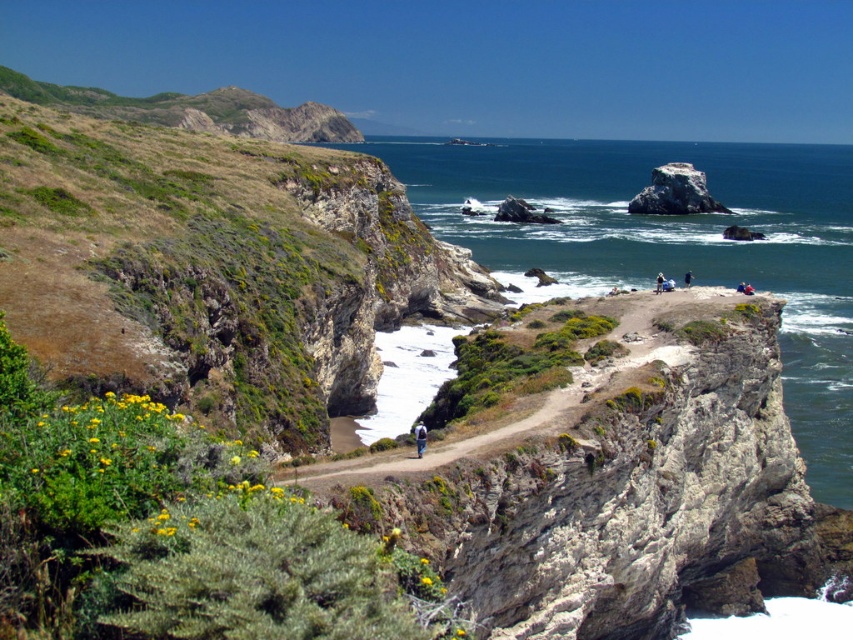
Question: Is green grassy cliff at center-left further to the viewer compared to dark blue fabric at upper center?

Choices:
 (A) no
 (B) yes

Answer: (A)

Question: Which of the following is the farthest from the observer?

Choices:
 (A) (477, 164)
 (B) (315, 195)
 (C) (685, 276)

Answer: (A)

Question: Does clear blue water at upper center have a greater width compared to brown fabric backpack at center?

Choices:
 (A) no
 (B) yes

Answer: (B)

Question: Considering the relative positions of green grassy cliff at center-left and brown fabric backpack at center in the image provided, where is green grassy cliff at center-left located with respect to brown fabric backpack at center?

Choices:
 (A) left
 (B) right

Answer: (A)

Question: Which object appears closest to the camera in this image?

Choices:
 (A) clear blue water at upper center
 (B) dark blue fabric at upper center
 (C) brown fabric backpack at center
 (D) white fabric at center

Answer: (C)

Question: Among these points, which one is farthest from the camera?

Choices:
 (A) (426, 432)
 (B) (662, 291)
 (C) (834, 460)

Answer: (C)